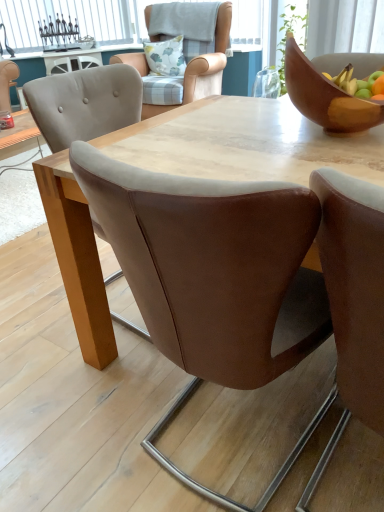
You are a GUI agent. You are given a task and a screenshot of the screen. Output one action in this format:
    pyautogui.click(x=<x>, y=<y>)
    Task: Click on the free space to the left of wooden bowl at upper right
    This screenshot has width=384, height=512.
    Given the screenshot: What is the action you would take?
    [241, 137]